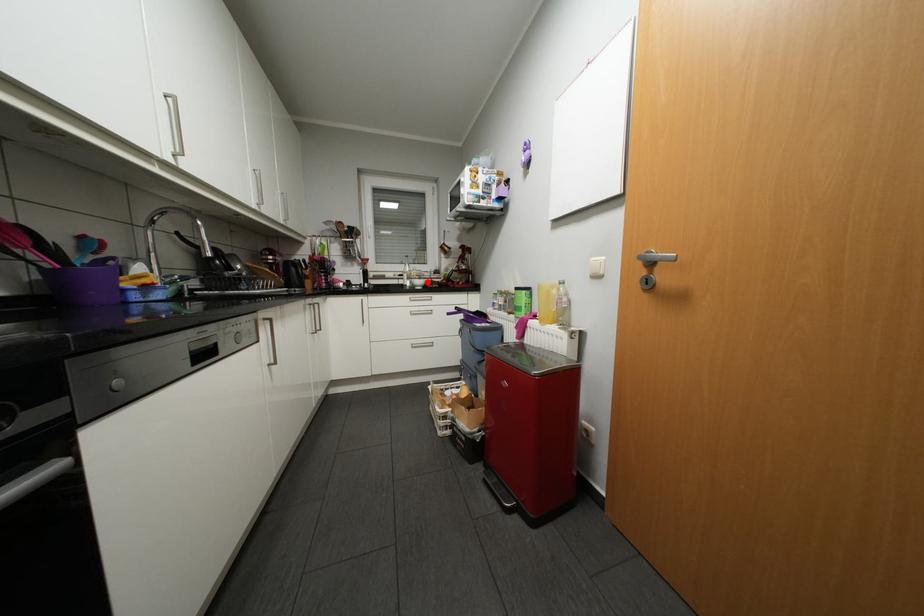
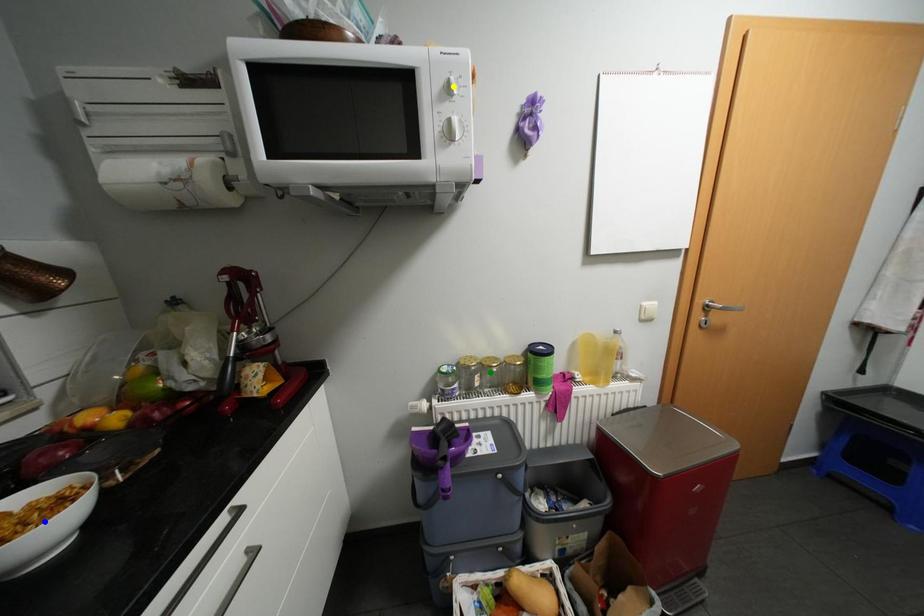
Question: I am providing you with two images of the same scene from different viewpoints. A red point is marked on the first image. You are given multiple points on the second image. Which mark in image 2 goes with the point in image 1?

Choices:
 (A) yellow point
 (B) green point
 (C) blue point

Answer: (C)